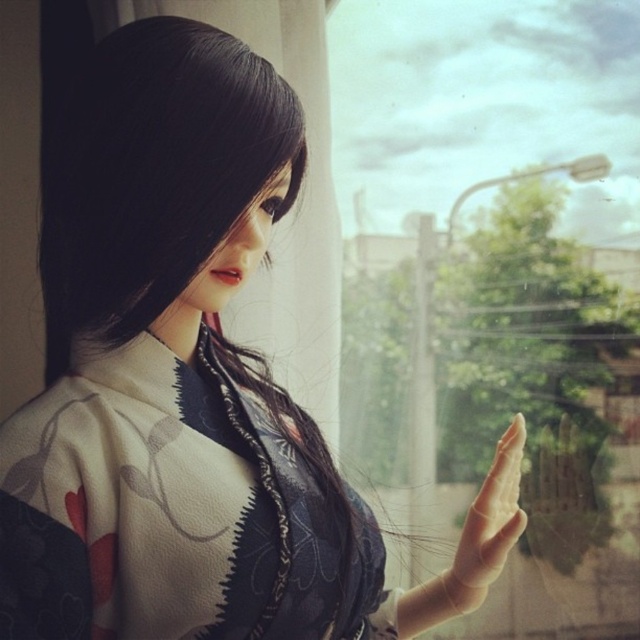
How far apart are transparent glass window at center and smooth skin hand at center?

transparent glass window at center is 22.02 inches from smooth skin hand at center.

From the picture: Does transparent glass window at center appear on the left side of smooth skin hand at center?

Incorrect, transparent glass window at center is not on the left side of smooth skin hand at center.

In order to click on transparent glass window at center in this screenshot , I will do `click(497, 285)`.

Identify the location of transparent glass window at center. The image size is (640, 640). (497, 285).

Can you confirm if transparent glass window at center is positioned to the right of white silk kimono at center?

Yes, transparent glass window at center is to the right of white silk kimono at center.

Between transparent glass window at center and white silk kimono at center, which one has less height?

white silk kimono at center

Between point (378, 484) and point (1, 618), which one is positioned in front?

Point (1, 618) is more forward.

The height and width of the screenshot is (640, 640). Find the location of `transparent glass window at center`. transparent glass window at center is located at coordinates (497, 285).

Does white silk kimono at center come behind smooth skin hand at center?

That is False.

Who is lower down, white silk kimono at center or smooth skin hand at center?

Positioned lower is smooth skin hand at center.

The width and height of the screenshot is (640, 640). In order to click on white silk kimono at center in this screenshot , I will do `click(157, 509)`.